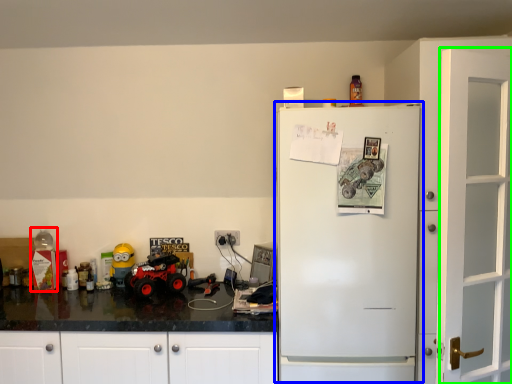
Question: Which object is the farthest from toy (highlighted by a red box)? Choose among these: refrigerator (highlighted by a blue box) or door (highlighted by a green box).

Choices:
 (A) refrigerator
 (B) door

Answer: (B)